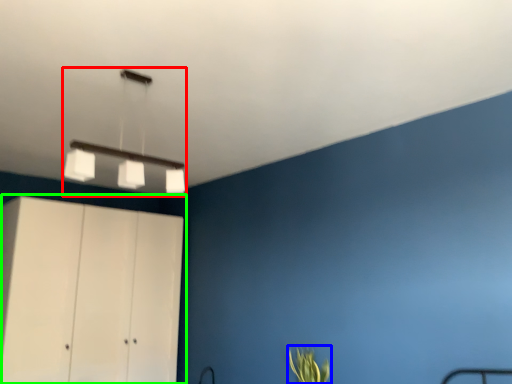
Question: Which is farther away from lamp (highlighted by a red box)? plant (highlighted by a blue box) or cupboard (highlighted by a green box)?

Choices:
 (A) plant
 (B) cupboard

Answer: (A)